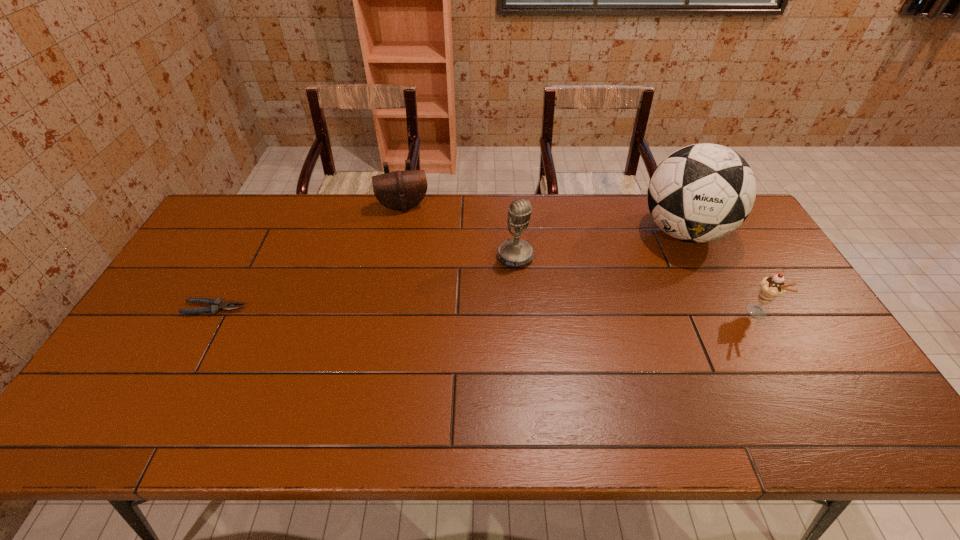
What are the coordinates of `vacant space located 0.380m with the flap open on the pouch` in the screenshot? It's located at coord(423,294).

Locate an element on the screen. The height and width of the screenshot is (540, 960). free location located with the flap open on the pouch is located at coordinates (424, 299).

Locate an element on the screen. vacant position located on the front-facing side of the third object from right to left is located at coordinates (596, 375).

This screenshot has height=540, width=960. What are the coordinates of `vacant space located 0.210m on the front-facing side of the third object from right to left` in the screenshot? It's located at (558, 319).

Locate an element on the screen. This screenshot has width=960, height=540. vacant region located on the front-facing side of the third object from right to left is located at coordinates (531, 280).

Image resolution: width=960 pixels, height=540 pixels. In order to click on vacant area located on the surface of the soccer ball where the brand logo is visible in this screenshot , I will do `click(600, 287)`.

Locate an element on the screen. This screenshot has width=960, height=540. free spot located on the surface of the soccer ball where the brand logo is visible is located at coordinates (635, 264).

Find the location of a particular element. This screenshot has width=960, height=540. blank space located on the surface of the soccer ball where the brand logo is visible is located at coordinates (635, 264).

This screenshot has height=540, width=960. What are the coordinates of `pouch located at the far edge` in the screenshot? It's located at (401, 190).

Find the location of a particular element. This screenshot has width=960, height=540. soccer ball positioned at the far edge is located at coordinates (702, 192).